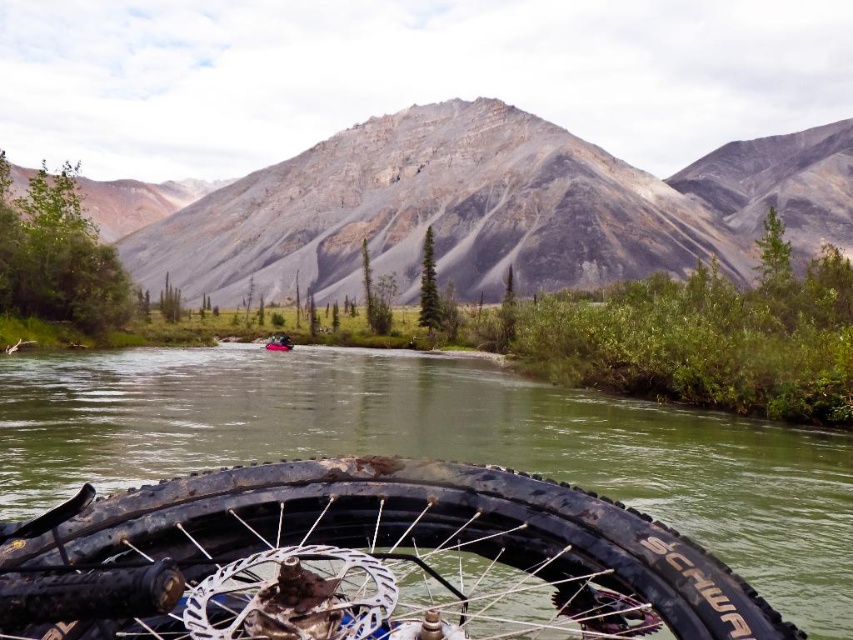
Question: Which point is farther to the camera?

Choices:
 (A) rubber boat at center
 (B) rusty metal tire at bottom

Answer: (A)

Question: Is rusty metal tire at bottom above rubber boat at center?

Choices:
 (A) yes
 (B) no

Answer: (B)

Question: Can you confirm if rusty metal tire at bottom is smaller than rubber boat at center?

Choices:
 (A) no
 (B) yes

Answer: (A)

Question: Which point is farther to the camera?

Choices:
 (A) rubber boat at center
 (B) rusty metal tire at bottom

Answer: (A)

Question: Does rusty metal tire at bottom have a larger size compared to rubber boat at center?

Choices:
 (A) no
 (B) yes

Answer: (B)

Question: Which object is farther from the camera taking this photo?

Choices:
 (A) rusty metal tire at bottom
 (B) rubber boat at center

Answer: (B)